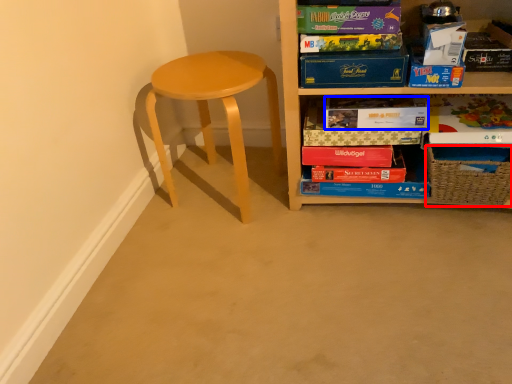
Question: Among these objects, which one is farthest to the camera, basket (highlighted by a red box) or paperback book (highlighted by a blue box)?

Choices:
 (A) basket
 (B) paperback book

Answer: (B)